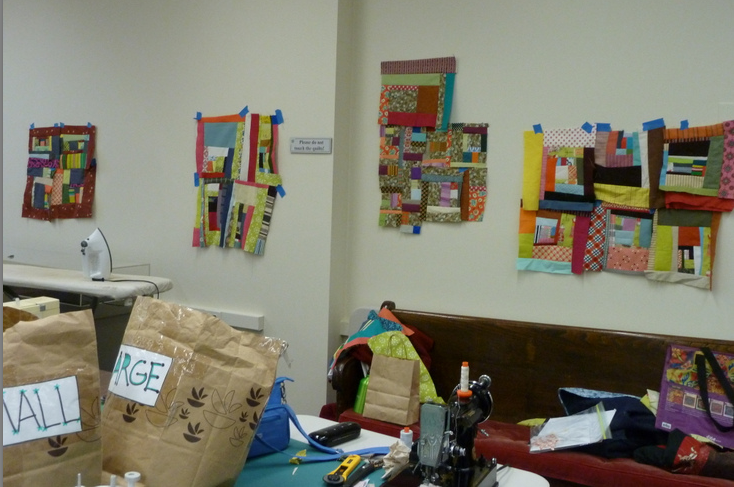
The width and height of the screenshot is (734, 487). I want to click on iron, so click(x=103, y=252).